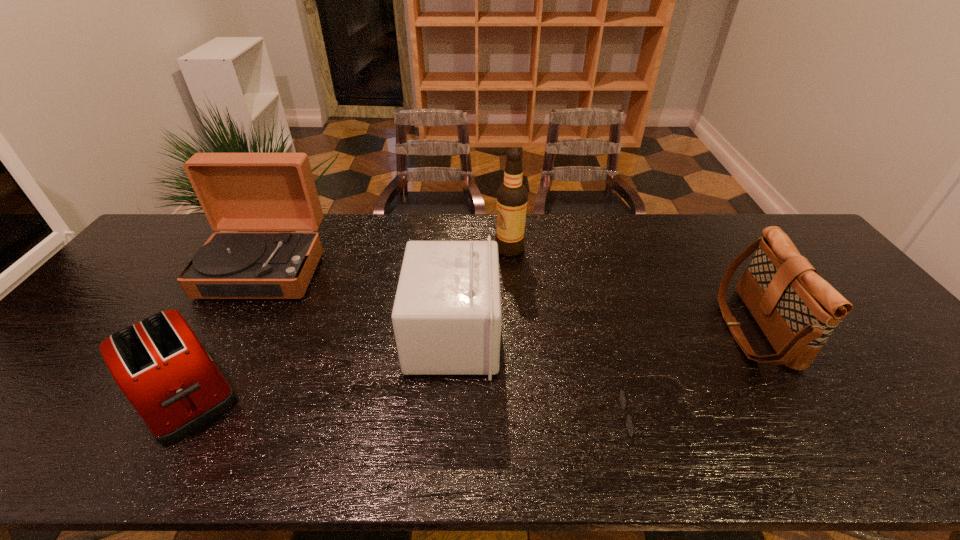
I want to click on free spot between the phonograph record and the rightmost object, so click(x=509, y=298).

Where is `unoccupied position between the toaster and the phonograph record`? Image resolution: width=960 pixels, height=540 pixels. unoccupied position between the toaster and the phonograph record is located at coordinates (225, 330).

Identify the location of free space between the second object from right to left and the first-aid kit. coord(552,377).

Find the location of a particular element. Image resolution: width=960 pixels, height=540 pixels. empty space between the toaster and the first-aid kit is located at coordinates (319, 364).

Locate an element on the screen. The height and width of the screenshot is (540, 960). free space between the phonograph record and the first-aid kit is located at coordinates (359, 302).

I want to click on free space between the fourth object from left to right and the shoulder bag, so click(632, 289).

Where is `free area in between the spectacles and the third object from right to left`? The image size is (960, 540). free area in between the spectacles and the third object from right to left is located at coordinates [x=581, y=334].

In order to click on free space between the spectacles and the first-aid kit in this screenshot , I will do `click(552, 377)`.

This screenshot has width=960, height=540. I want to click on object that stands as the fifth closest to the second object from right to left, so click(237, 191).

Where is `the fourth closest object to the first-aid kit`? This screenshot has height=540, width=960. the fourth closest object to the first-aid kit is located at coordinates (160, 365).